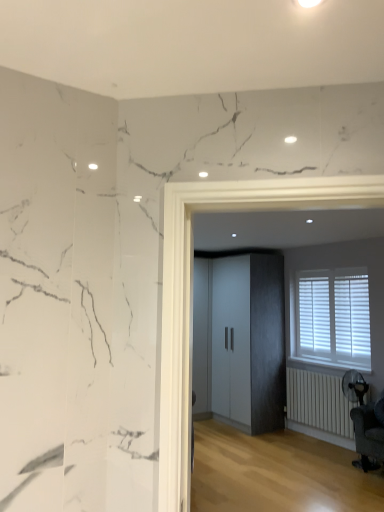
Question: Is white matte radiator at lower right bigger than dark gray fabric swivel chair at lower right?

Choices:
 (A) no
 (B) yes

Answer: (A)

Question: Considering the relative sizes of white matte radiator at lower right and dark gray fabric swivel chair at lower right in the image provided, is white matte radiator at lower right smaller than dark gray fabric swivel chair at lower right?

Choices:
 (A) yes
 (B) no

Answer: (A)

Question: Does white matte radiator at lower right appear on the right side of dark gray fabric swivel chair at lower right?

Choices:
 (A) no
 (B) yes

Answer: (A)

Question: From a real-world perspective, does white matte radiator at lower right sit lower than dark gray fabric swivel chair at lower right?

Choices:
 (A) no
 (B) yes

Answer: (A)

Question: Is white matte radiator at lower right outside dark gray fabric swivel chair at lower right?

Choices:
 (A) yes
 (B) no

Answer: (A)

Question: From the image's perspective, is white matte radiator at lower right on dark gray fabric swivel chair at lower right?

Choices:
 (A) no
 (B) yes

Answer: (A)

Question: From the image's perspective, is white wood blinds at right on top of matte gray cabinet at center?

Choices:
 (A) yes
 (B) no

Answer: (A)

Question: Is white wood blinds at right wider than matte gray cabinet at center?

Choices:
 (A) yes
 (B) no

Answer: (B)

Question: From a real-world perspective, is white wood blinds at right located beneath matte gray cabinet at center?

Choices:
 (A) yes
 (B) no

Answer: (B)

Question: Is white wood blinds at right oriented away from matte gray cabinet at center?

Choices:
 (A) yes
 (B) no

Answer: (B)

Question: Is white wood blinds at right shorter than matte gray cabinet at center?

Choices:
 (A) yes
 (B) no

Answer: (A)

Question: Considering the relative sizes of white wood blinds at right and matte gray cabinet at center in the image provided, is white wood blinds at right taller than matte gray cabinet at center?

Choices:
 (A) no
 (B) yes

Answer: (A)

Question: Can you confirm if white matte radiator at lower right is thinner than white wood blinds at right?

Choices:
 (A) yes
 (B) no

Answer: (A)